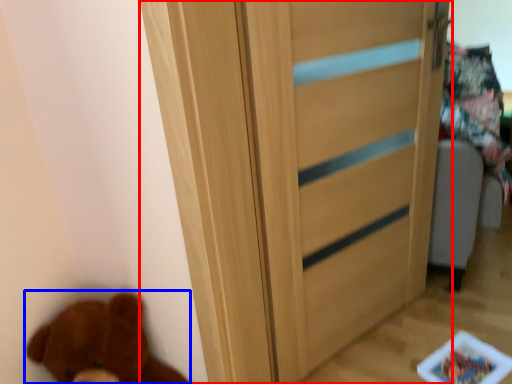
Question: Which object is closer to the camera taking this photo, door (highlighted by a red box) or brown bear (highlighted by a blue box)?

Choices:
 (A) door
 (B) brown bear

Answer: (B)